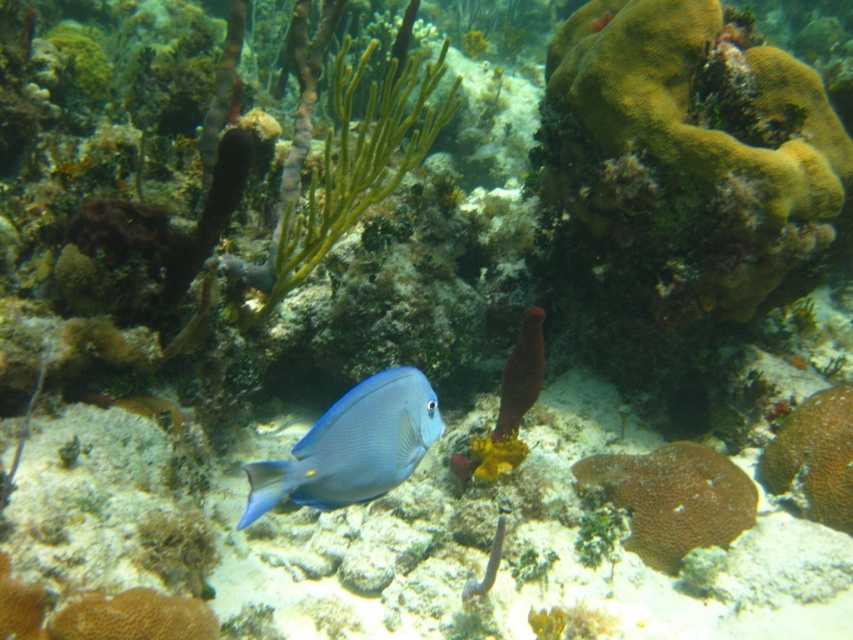
Question: Is blue glossy fish at center to the right of brown textured coral at center from the viewer's perspective?

Choices:
 (A) no
 (B) yes

Answer: (A)

Question: Can you confirm if blue glossy fish at center is bigger than brown textured coral at center?

Choices:
 (A) yes
 (B) no

Answer: (B)

Question: Which point is farther from the camera taking this photo?

Choices:
 (A) (717, 522)
 (B) (364, 406)

Answer: (A)

Question: Does blue glossy fish at center have a lesser width compared to brown textured coral at center?

Choices:
 (A) yes
 (B) no

Answer: (A)

Question: Which point is farther to the camera?

Choices:
 (A) brown textured coral at center
 (B) blue glossy fish at center

Answer: (A)